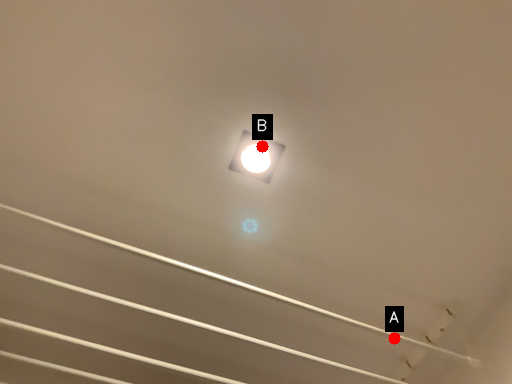
Question: Two points are circled on the image, labeled by A and B beside each circle. Which point appears closest to the camera in this image?

Choices:
 (A) A is closer
 (B) B is closer

Answer: (B)